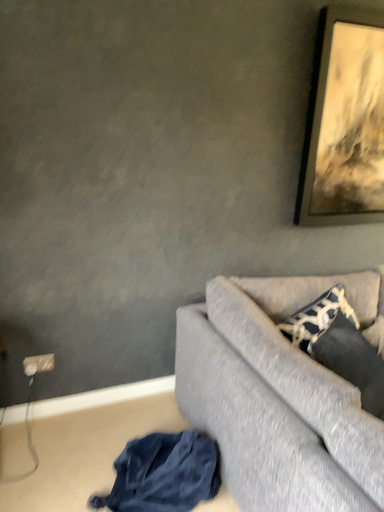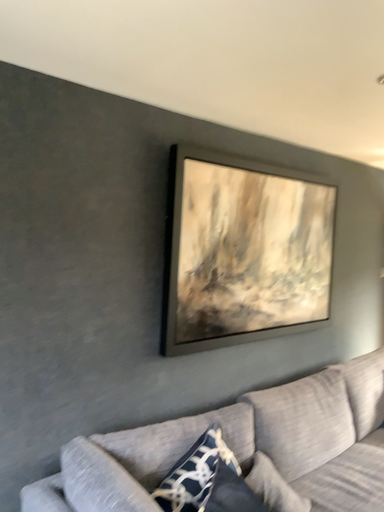
Question: How did the camera likely rotate when shooting the video?

Choices:
 (A) rotated right
 (B) rotated left

Answer: (A)